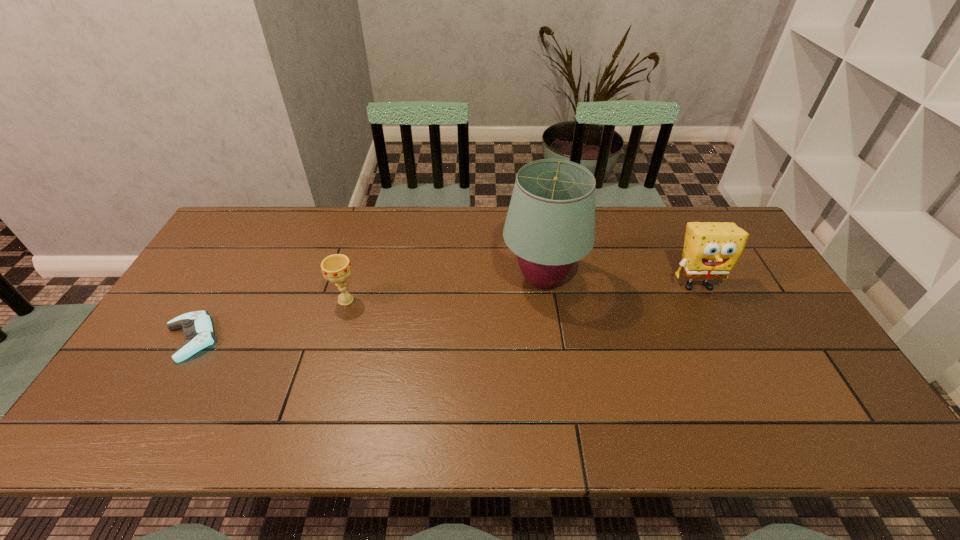
This screenshot has width=960, height=540. I want to click on vacant area situated on the back of the second shortest object, so click(x=369, y=222).

Where is `vacant space located 0.210m on the back of the shortest object`? The width and height of the screenshot is (960, 540). vacant space located 0.210m on the back of the shortest object is located at coordinates (235, 265).

Identify the location of object located in the left edge section of the desktop. (198, 330).

You are a GUI agent. You are given a task and a screenshot of the screen. Output one action in this format:
    pyautogui.click(x=<x>, y=<y>)
    Task: Click on the object located at the right edge
    This screenshot has height=540, width=960.
    Given the screenshot: What is the action you would take?
    pyautogui.click(x=711, y=249)

Image resolution: width=960 pixels, height=540 pixels. I want to click on vacant position at the far edge of the desktop, so click(x=476, y=244).

Locate an element on the screen. This screenshot has width=960, height=540. vacant space at the near edge is located at coordinates (221, 407).

I want to click on free space at the left edge of the desktop, so click(x=167, y=363).

The width and height of the screenshot is (960, 540). In order to click on vacant space at the right edge of the desktop in this screenshot , I will do tap(786, 338).

Identify the location of vacant space at the far right corner. This screenshot has height=540, width=960. (695, 218).

This screenshot has width=960, height=540. I want to click on unoccupied area between the shortest object and the second object from right to left, so click(367, 309).